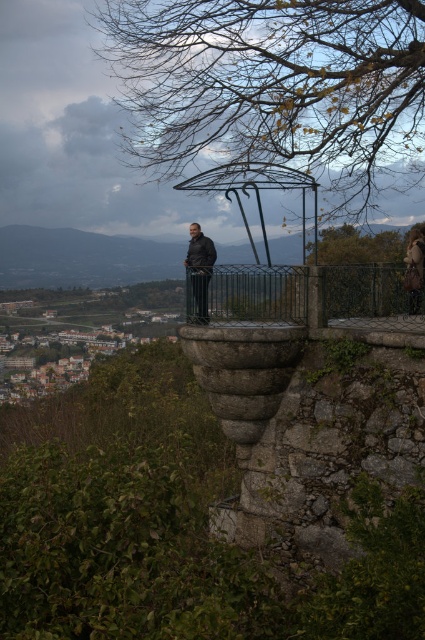
Is brown leafy branches at upper center wider than green wrought iron fence at center?

Yes.

Find the location of `brown leafy branches at upper center`. brown leafy branches at upper center is located at coordinates (274, 86).

The height and width of the screenshot is (640, 425). What are the coordinates of `brown leafy branches at upper center` in the screenshot? It's located at (274, 86).

Does green wrought iron fence at center have a greater height compared to dark gray jacket at center?

No.

Between green wrought iron fence at center and dark gray jacket at center, which one has more height?

With more height is dark gray jacket at center.

Between point (277, 310) and point (195, 248), which one is positioned in front?

Positioned in front is point (195, 248).

Identify the location of green wrought iron fence at center. (300, 292).

Does brown leafy branches at upper center appear under dark gray jacket at center?

No, brown leafy branches at upper center is not below dark gray jacket at center.

Which is behind, point (102, 58) or point (206, 291)?

Positioned behind is point (102, 58).

At what (x,y) coordinates should I click in order to perform the action: click on brown leafy branches at upper center. Please return your answer as a coordinate pair (x, y). The image size is (425, 640). Looking at the image, I should click on (274, 86).